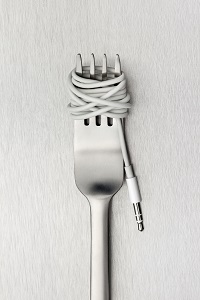
This screenshot has height=300, width=200. What are the coordinates of `surface` in the screenshot? It's located at (71, 256).